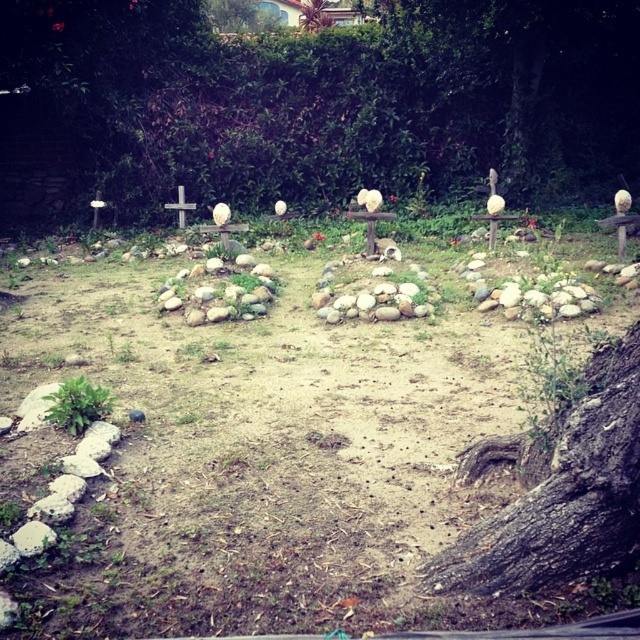
Between green leafy tree at center and green leafy tree at upper center, which one appears on the left side from the viewer's perspective?

green leafy tree at upper center

This screenshot has width=640, height=640. In order to click on green leafy tree at center in this screenshot , I will do `click(337, 97)`.

This screenshot has width=640, height=640. What are the coordinates of `green leafy tree at center` in the screenshot? It's located at (337, 97).

Who is taller, smooth stone circle at center or green leafy tree at center?

green leafy tree at center is taller.

Where is `smooth stone circle at center`? This screenshot has width=640, height=640. smooth stone circle at center is located at coordinates (264, 456).

Where is `smooth stone circle at center`? This screenshot has width=640, height=640. smooth stone circle at center is located at coordinates (264, 456).

Can you confirm if green leafy tree at center is taller than white wooden cross at center?

Incorrect, green leafy tree at center's height is not larger of white wooden cross at center's.

Who is more distant from viewer, (532, 26) or (173, 209)?

Point (173, 209)

Is point (100, 113) positioned after point (177, 202)?

That is False.

Find the location of a particular element. The image size is (640, 640). green leafy tree at center is located at coordinates (337, 97).